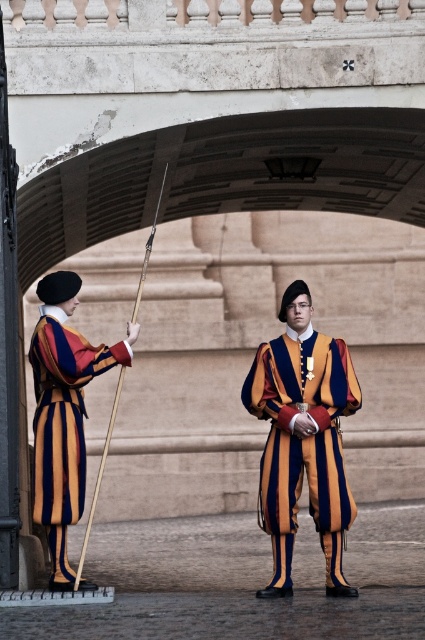
Question: Does velvet striped uniform at center appear on the left side of matte striped uniform at left?

Choices:
 (A) no
 (B) yes

Answer: (A)

Question: Which of the following is the closest to the observer?

Choices:
 (A) (317, 516)
 (B) (73, 275)

Answer: (A)

Question: Does velvet striped uniform at center have a lesser width compared to matte striped uniform at left?

Choices:
 (A) yes
 (B) no

Answer: (A)

Question: Does velvet striped uniform at center lie behind matte striped uniform at left?

Choices:
 (A) no
 (B) yes

Answer: (B)